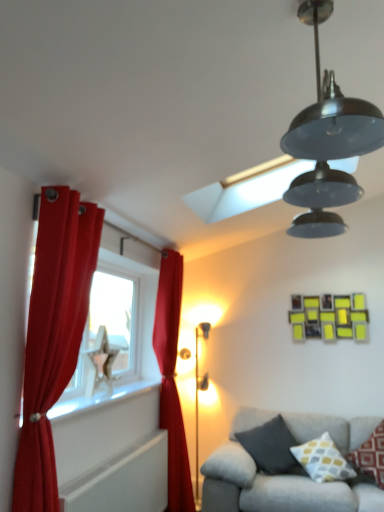
The image size is (384, 512). Identify the location of patterned fabric pillow at lower right, placed as the 1th pillow when sorted from right to left. (370, 456).

What is the approximate width of white glossy window sill at lower left?

The width of white glossy window sill at lower left is 10.35 inches.

You are a GUI agent. You are given a task and a screenshot of the screen. Output one action in this format:
    pyautogui.click(x=<x>, y=<y>)
    Task: Click on the white glossy window sill at lower left
    This screenshot has height=512, width=384.
    Given the screenshot: What is the action you would take?
    pyautogui.click(x=101, y=400)

This screenshot has width=384, height=512. What do you see at coordinates (53, 335) in the screenshot?
I see `satin red curtain at left, which is counted as the 1th curtain, starting from the left` at bounding box center [53, 335].

How much space does dark gray fabric pillow at lower right, which appears as the third pillow when viewed from the right, occupy horizontally?

dark gray fabric pillow at lower right, which appears as the third pillow when viewed from the right, is 15.39 inches in width.

Where is `gray fabric couch at lower right`? gray fabric couch at lower right is located at coordinates (273, 481).

At what (x,y) coordinates should I click in order to perform the action: click on yellow and gray patterned pillow at lower right, marked as the 2th pillow in a right-to-left arrangement. Please return your answer as a coordinate pair (x, y). Looking at the image, I should click on (323, 460).

Is gray fabric couch at lower right far away from satin red curtain at left, which is the 1th curtain in front-to-back order?

Yes.

What's the angular difference between gray fabric couch at lower right and satin red curtain at left, the 2th curtain viewed from the back,'s facing directions?

gray fabric couch at lower right and satin red curtain at left, the 2th curtain viewed from the back, are facing 178 degrees away from each other.

Based on the photo, from a real-world perspective, between gray fabric couch at lower right and satin red curtain at left, which is the 1th curtain in front-to-back order, who is vertically lower?

From a 3D spatial view, gray fabric couch at lower right is below.

Between point (221, 468) and point (75, 332), which one is positioned in front?

The point (75, 332) is in front.

Considering the positions of objects red velvet curtain at center, placed as the 1th curtain when sorted from back to front, and gold metallic floor lamp at center in the image provided, who is more to the left, red velvet curtain at center, placed as the 1th curtain when sorted from back to front, or gold metallic floor lamp at center?

From the viewer's perspective, red velvet curtain at center, placed as the 1th curtain when sorted from back to front, appears more on the left side.

From a real-world perspective, is red velvet curtain at center, placed as the 1th curtain when sorted from back to front, below gold metallic floor lamp at center?

No, from a real-world perspective, red velvet curtain at center, placed as the 1th curtain when sorted from back to front, is not under gold metallic floor lamp at center.

Is the surface of red velvet curtain at center, marked as the 2th curtain in a front-to-back arrangement, in direct contact with gold metallic floor lamp at center?

No, red velvet curtain at center, marked as the 2th curtain in a front-to-back arrangement, is not beside gold metallic floor lamp at center.

The width and height of the screenshot is (384, 512). What are the coordinates of `curtain that is the 1st one when counting forward from the gold metallic floor lamp at center` in the screenshot? It's located at (172, 380).

From a real-world perspective, which is physically below, white glossy window sill at lower left or gold metallic floor lamp at center?

From a 3D spatial view, gold metallic floor lamp at center is below.

Considering the relative positions of white glossy window sill at lower left and gold metallic floor lamp at center in the image provided, is white glossy window sill at lower left in front of gold metallic floor lamp at center?

Yes, white glossy window sill at lower left is closer to the camera.

Is white glossy window sill at lower left far from gold metallic floor lamp at center?

Yes, white glossy window sill at lower left and gold metallic floor lamp at center are located far from each other.

Is gold metallic floor lamp at center inside white glossy window sill at lower left?

No, white glossy window sill at lower left does not contain gold metallic floor lamp at center.

From the image's perspective, does gold metallic floor lamp at center appear higher than gray fabric couch at lower right?

Indeed, from the image's perspective, gold metallic floor lamp at center is shown above gray fabric couch at lower right.

Is gray fabric couch at lower right at the back of gold metallic floor lamp at center?

gold metallic floor lamp at center does not have its back to gray fabric couch at lower right.

Which is more to the right, gold metallic floor lamp at center or gray fabric couch at lower right?

Positioned to the right is gray fabric couch at lower right.

Considering the points (254, 416) and (327, 441), which point is behind, point (254, 416) or point (327, 441)?

The point (254, 416) is farther from the camera.

Is gray fabric couch at lower right not near yellow and gray patterned pillow at lower right, arranged as the 2th pillow when viewed from the left?

No, gray fabric couch at lower right is in close proximity to yellow and gray patterned pillow at lower right, arranged as the 2th pillow when viewed from the left.

Between gray fabric couch at lower right and yellow and gray patterned pillow at lower right, marked as the 2th pillow in a right-to-left arrangement, which one has smaller size?

yellow and gray patterned pillow at lower right, marked as the 2th pillow in a right-to-left arrangement, is smaller.

Considering the relative sizes of gray fabric couch at lower right and yellow and gray patterned pillow at lower right, arranged as the 2th pillow when viewed from the left, in the image provided, is gray fabric couch at lower right thinner than yellow and gray patterned pillow at lower right, arranged as the 2th pillow when viewed from the left,?

In fact, gray fabric couch at lower right might be wider than yellow and gray patterned pillow at lower right, arranged as the 2th pillow when viewed from the left.

Considering the relative sizes of gray fabric couch at lower right and red velvet curtain at center, marked as the 2th curtain in a front-to-back arrangement, in the image provided, is gray fabric couch at lower right shorter than red velvet curtain at center, marked as the 2th curtain in a front-to-back arrangement,?

Yes.

From the image's perspective, is gray fabric couch at lower right located above or below red velvet curtain at center, which is counted as the first curtain, starting from the right?

Clearly, from the image's perspective, gray fabric couch at lower right is below red velvet curtain at center, which is counted as the first curtain, starting from the right.

From a real-world perspective, is gray fabric couch at lower right under red velvet curtain at center, marked as the 2th curtain in a front-to-back arrangement?

Correct, in the physical world, gray fabric couch at lower right is lower than red velvet curtain at center, marked as the 2th curtain in a front-to-back arrangement.

Is gray fabric couch at lower right looking in the opposite direction of red velvet curtain at center, which is counted as the first curtain, starting from the right?

No, gray fabric couch at lower right is not facing away from red velvet curtain at center, which is counted as the first curtain, starting from the right.

Considering the relative sizes of gold metallic floor lamp at center and dark gray fabric pillow at lower right, which appears as the third pillow when viewed from the right, in the image provided, is gold metallic floor lamp at center thinner than dark gray fabric pillow at lower right, which appears as the third pillow when viewed from the right,?

Indeed, gold metallic floor lamp at center has a lesser width compared to dark gray fabric pillow at lower right, which appears as the third pillow when viewed from the right.

From the image's perspective, is gold metallic floor lamp at center located above or below dark gray fabric pillow at lower right, which appears as the third pillow when viewed from the right?

From the image's perspective, gold metallic floor lamp at center appears above dark gray fabric pillow at lower right, which appears as the third pillow when viewed from the right.

Which of these two, gold metallic floor lamp at center or dark gray fabric pillow at lower right, the first pillow from the left, is smaller?

dark gray fabric pillow at lower right, the first pillow from the left, is smaller.

The height and width of the screenshot is (512, 384). What are the coordinates of `studio couch below the satin red curtain at left, which is counted as the 1th curtain, starting from the left (from a real-world perspective)` in the screenshot? It's located at (273, 481).

This screenshot has width=384, height=512. Identify the location of table lamp below the red velvet curtain at center, marked as the 2th curtain in a front-to-back arrangement (from the image's perspective). (197, 398).

Estimate the real-world distances between objects in this image. Which object is further from gold metallic floor lamp at center, dark gray fabric pillow at lower right, which appears as the third pillow when viewed from the right, or satin red curtain at left, the 2th curtain viewed from the back?

Among the two, satin red curtain at left, the 2th curtain viewed from the back, is located further to gold metallic floor lamp at center.

Estimate the real-world distances between objects in this image. Which object is closer to dark gray fabric pillow at lower right, the first pillow from the left, patterned fabric pillow at lower right, placed as the 1th pillow when sorted from right to left, or white textured radiator at lower left?

patterned fabric pillow at lower right, placed as the 1th pillow when sorted from right to left, is closer to dark gray fabric pillow at lower right, the first pillow from the left.

Estimate the real-world distances between objects in this image. Which object is closer to patterned fabric pillow at lower right, which is counted as the 3th pillow, starting from the left, white textured radiator at lower left or gold metallic floor lamp at center?

Based on the image, gold metallic floor lamp at center appears to be nearer to patterned fabric pillow at lower right, which is counted as the 3th pillow, starting from the left.

Looking at the image, which one is located closer to white textured radiator at lower left, gold metallic floor lamp at center or red velvet curtain at center, which is counted as the second curtain, starting from the left?

red velvet curtain at center, which is counted as the second curtain, starting from the left, is positioned closer to the anchor white textured radiator at lower left.

When comparing their distances from dark gray fabric pillow at lower right, the first pillow from the left, does gold metallic floor lamp at center or patterned fabric pillow at lower right, which is counted as the 3th pillow, starting from the left, seem closer?

patterned fabric pillow at lower right, which is counted as the 3th pillow, starting from the left, is positioned closer to the anchor dark gray fabric pillow at lower right, the first pillow from the left.

Which object lies nearer to the anchor point yellow and gray patterned pillow at lower right, marked as the 2th pillow in a right-to-left arrangement, red velvet curtain at center, which is counted as the first curtain, starting from the right, or gold metallic floor lamp at center?

red velvet curtain at center, which is counted as the first curtain, starting from the right, is positioned closer to the anchor yellow and gray patterned pillow at lower right, marked as the 2th pillow in a right-to-left arrangement.

Considering their positions, is red velvet curtain at center, which is counted as the first curtain, starting from the right, positioned closer to gold metallic floor lamp at center than patterned fabric pillow at lower right, which is counted as the 3th pillow, starting from the left?

red velvet curtain at center, which is counted as the first curtain, starting from the right.

When comparing their distances from white textured radiator at lower left, does satin red curtain at left, acting as the 2th curtain starting from the right, or patterned fabric pillow at lower right, which is counted as the 3th pillow, starting from the left, seem further?

patterned fabric pillow at lower right, which is counted as the 3th pillow, starting from the left, is further to white textured radiator at lower left.

Image resolution: width=384 pixels, height=512 pixels. I want to click on window sill between white textured radiator at lower left and gold metallic floor lamp at center along the z-axis, so click(101, 400).

Where is `curtain between white textured radiator at lower left and gold metallic floor lamp at center along the z-axis`? This screenshot has width=384, height=512. curtain between white textured radiator at lower left and gold metallic floor lamp at center along the z-axis is located at coordinates (172, 380).

Image resolution: width=384 pixels, height=512 pixels. Identify the location of radiator between satin red curtain at left, acting as the 2th curtain starting from the right, and yellow and gray patterned pillow at lower right, marked as the 2th pillow in a right-to-left arrangement. (123, 481).

Image resolution: width=384 pixels, height=512 pixels. What are the coordinates of `curtain between gray fabric couch at lower right and red velvet curtain at center, placed as the 1th curtain when sorted from back to front, in the front-back direction` in the screenshot? It's located at (53, 335).